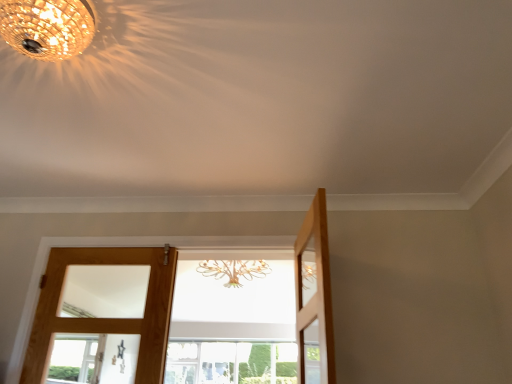
Locate an element on the screen. Image resolution: width=512 pixels, height=384 pixels. clear glass window at center is located at coordinates (231, 363).

What do you see at coordinates (47, 27) in the screenshot? Image resolution: width=512 pixels, height=384 pixels. I see `crystal chandelier at upper left` at bounding box center [47, 27].

Where is `wooden door at center, the second door in the left-to-right sequence`? wooden door at center, the second door in the left-to-right sequence is located at coordinates (106, 318).

Can you confirm if clear glass window at center is bigger than crystal chandelier at upper left?

Yes, clear glass window at center is bigger than crystal chandelier at upper left.

Considering the relative sizes of clear glass window at center and crystal chandelier at upper left in the image provided, is clear glass window at center thinner than crystal chandelier at upper left?

In fact, clear glass window at center might be wider than crystal chandelier at upper left.

From the picture: Is clear glass window at center further to camera compared to crystal chandelier at upper left?

Yes, it is.

Considering the positions of point (59, 56) and point (147, 329), is point (59, 56) closer or farther from the camera than point (147, 329)?

Point (59, 56) is positioned closer to the camera compared to point (147, 329).

Looking at their sizes, would you say crystal chandelier at upper left is wider or thinner than wooden door at center, acting as the second door starting from the right?

Clearly, crystal chandelier at upper left has more width compared to wooden door at center, acting as the second door starting from the right.

From the image's perspective, is crystal chandelier at upper left positioned above or below wooden door at center, the second door in the left-to-right sequence?

crystal chandelier at upper left is above wooden door at center, the second door in the left-to-right sequence.

How many degrees apart are the facing directions of crystal chandelier at upper left and wooden door at center, acting as the second door starting from the right?

180 degrees.

From the image's perspective, is light brown wooden door at left, the third door when ordered from right to left, positioned above or below light brown wooden door at right, positioned as the 3th door in left-to-right order?

light brown wooden door at left, the third door when ordered from right to left, is situated lower than light brown wooden door at right, positioned as the 3th door in left-to-right order, in the image.

Would you say light brown wooden door at left, which appears as the first door when viewed from the left, is outside light brown wooden door at right, positioned as the 3th door in left-to-right order?

light brown wooden door at left, which appears as the first door when viewed from the left, is positioned outside light brown wooden door at right, positioned as the 3th door in left-to-right order.

What's the angular difference between clear glass window at center and wooden door at center, the second door in the left-to-right sequence,'s facing directions?

They differ by 0.00133 degrees in their facing directions.

Does clear glass window at center have a lesser width compared to wooden door at center, acting as the second door starting from the right?

Incorrect, the width of clear glass window at center is not less than that of wooden door at center, acting as the second door starting from the right.

In the image, is clear glass window at center positioned in front of or behind wooden door at center, acting as the second door starting from the right?

clear glass window at center is behind wooden door at center, acting as the second door starting from the right.

From a real-world perspective, between clear glass window at center and wooden door at center, the second door in the left-to-right sequence, who is vertically higher?

From a 3D spatial view, clear glass window at center is above.

How far apart are wooden door at center, the second door in the left-to-right sequence, and clear glass window at center?

The distance of wooden door at center, the second door in the left-to-right sequence, from clear glass window at center is 1.11 meters.

Is point (156, 352) positioned before point (168, 344)?

That is True.

Considering the relative sizes of wooden door at center, the second door in the left-to-right sequence, and clear glass window at center in the image provided, is wooden door at center, the second door in the left-to-right sequence, bigger than clear glass window at center?

No.

Can you confirm if wooden door at center, the second door in the left-to-right sequence, is taller than clear glass window at center?

Correct, wooden door at center, the second door in the left-to-right sequence, is much taller as clear glass window at center.

Considering the relative sizes of light brown wooden door at left, the third door when ordered from right to left, and wooden door at center, the second door in the left-to-right sequence, in the image provided, is light brown wooden door at left, the third door when ordered from right to left, smaller than wooden door at center, the second door in the left-to-right sequence,?

Correct, light brown wooden door at left, the third door when ordered from right to left, occupies less space than wooden door at center, the second door in the left-to-right sequence.

From a real-world perspective, is light brown wooden door at left, the third door when ordered from right to left, on wooden door at center, the second door in the left-to-right sequence?

Incorrect, from a real-world perspective, light brown wooden door at left, the third door when ordered from right to left, is lower than wooden door at center, the second door in the left-to-right sequence.

Considering the positions of point (96, 323) and point (149, 285), is point (96, 323) closer or farther from the camera than point (149, 285)?

Point (96, 323) is positioned closer to the camera compared to point (149, 285).

Is wooden door at center, acting as the second door starting from the right, located within light brown wooden door at left, the third door when ordered from right to left?

No, wooden door at center, acting as the second door starting from the right, is not a part of light brown wooden door at left, the third door when ordered from right to left.

Can you confirm if light brown wooden door at right, the 1th door when ordered from right to left, is shorter than wooden door at center, the second door in the left-to-right sequence?

Yes, light brown wooden door at right, the 1th door when ordered from right to left, is shorter than wooden door at center, the second door in the left-to-right sequence.

From the image's perspective, is light brown wooden door at right, the 1th door when ordered from right to left, located beneath wooden door at center, acting as the second door starting from the right?

No.

Is light brown wooden door at right, the 1th door when ordered from right to left, oriented towards wooden door at center, the second door in the left-to-right sequence?

Yes, light brown wooden door at right, the 1th door when ordered from right to left, is facing wooden door at center, the second door in the left-to-right sequence.

In order to click on lamp above the clear glass window at center (from a real-world perspective) in this screenshot , I will do `click(47, 27)`.

The width and height of the screenshot is (512, 384). Find the location of `lamp above the wooden door at center, acting as the second door starting from the right (from the image's perspective)`. lamp above the wooden door at center, acting as the second door starting from the right (from the image's perspective) is located at coordinates (47, 27).

Considering their positions, is light brown wooden door at left, which appears as the first door when viewed from the left, positioned further to light brown wooden door at right, positioned as the 3th door in left-to-right order, than crystal chandelier at upper left?

Among the two, crystal chandelier at upper left is located further to light brown wooden door at right, positioned as the 3th door in left-to-right order.

From the image, which object appears to be nearer to light brown wooden door at left, which appears as the first door when viewed from the left, light brown wooden door at right, the 1th door when ordered from right to left, or crystal chandelier at upper left?

The object closer to light brown wooden door at left, which appears as the first door when viewed from the left, is light brown wooden door at right, the 1th door when ordered from right to left.

Considering their positions, is light brown wooden door at left, the third door when ordered from right to left, positioned closer to wooden door at center, acting as the second door starting from the right, than light brown wooden door at right, the 1th door when ordered from right to left?

light brown wooden door at left, the third door when ordered from right to left, is closer to wooden door at center, acting as the second door starting from the right.

Based on the photo, estimate the real-world distances between objects in this image. Which object is further from light brown wooden door at left, the third door when ordered from right to left, clear glass window at center or crystal chandelier at upper left?

Based on the image, crystal chandelier at upper left appears to be further to light brown wooden door at left, the third door when ordered from right to left.

From the image, which object appears to be farther from wooden door at center, acting as the second door starting from the right, clear glass window at center or crystal chandelier at upper left?

crystal chandelier at upper left.

Which object lies nearer to the anchor point light brown wooden door at right, the 1th door when ordered from right to left, light brown wooden door at left, which appears as the first door when viewed from the left, or clear glass window at center?

light brown wooden door at left, which appears as the first door when viewed from the left, is positioned closer to the anchor light brown wooden door at right, the 1th door when ordered from right to left.

Looking at this image, estimate the real-world distances between objects in this image. Which object is closer to clear glass window at center, crystal chandelier at upper left or light brown wooden door at left, which appears as the first door when viewed from the left?

The object closer to clear glass window at center is light brown wooden door at left, which appears as the first door when viewed from the left.

Looking at the image, which one is located further to wooden door at center, the second door in the left-to-right sequence, light brown wooden door at left, which appears as the first door when viewed from the left, or crystal chandelier at upper left?

Among the two, crystal chandelier at upper left is located further to wooden door at center, the second door in the left-to-right sequence.

This screenshot has width=512, height=384. Identify the location of door located between wooden door at center, acting as the second door starting from the right, and clear glass window at center in the depth direction. (144, 313).

Where is `door between crystal chandelier at upper left and wooden door at center, the second door in the left-to-right sequence, in the up-down direction`? The height and width of the screenshot is (384, 512). door between crystal chandelier at upper left and wooden door at center, the second door in the left-to-right sequence, in the up-down direction is located at coordinates (314, 297).

Where is `door located between light brown wooden door at left, the third door when ordered from right to left, and light brown wooden door at right, the 1th door when ordered from right to left, in the left-right direction`? door located between light brown wooden door at left, the third door when ordered from right to left, and light brown wooden door at right, the 1th door when ordered from right to left, in the left-right direction is located at coordinates (106, 318).